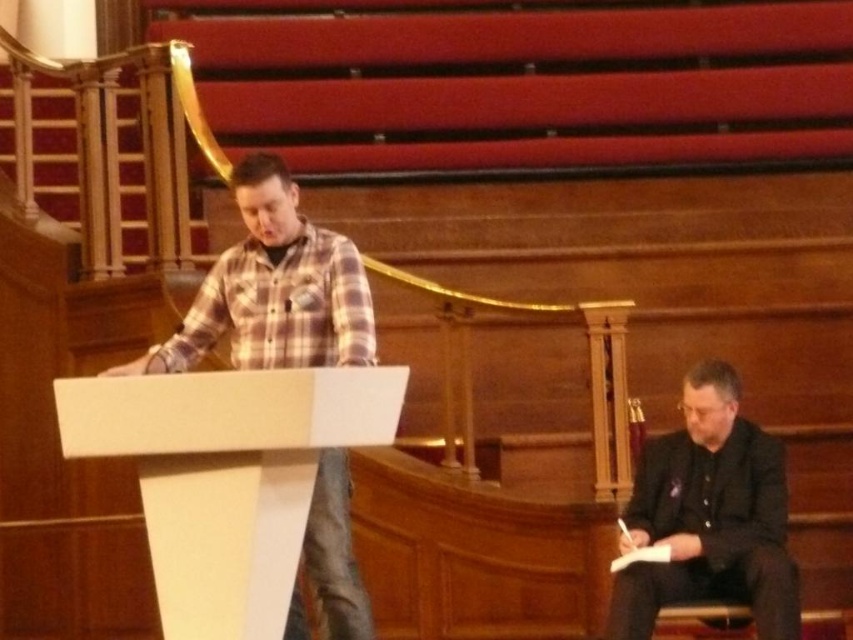
Question: Is plaid flannel shirt at center positioned in front of black matte suit at lower right?

Choices:
 (A) yes
 (B) no

Answer: (B)

Question: Which point is farther to the camera?

Choices:
 (A) plaid flannel shirt at center
 (B) black matte suit at lower right

Answer: (A)

Question: Observing the image, what is the correct spatial positioning of plaid flannel shirt at center in reference to black matte suit at lower right?

Choices:
 (A) above
 (B) below

Answer: (A)

Question: Does plaid flannel shirt at center appear on the right side of black matte suit at lower right?

Choices:
 (A) yes
 (B) no

Answer: (B)